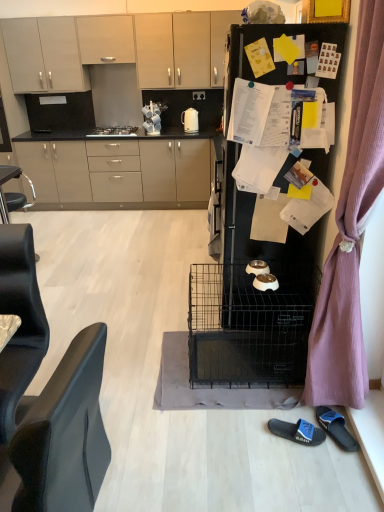
You are a GUI agent. You are given a task and a screenshot of the screen. Output one action in this format:
    pyautogui.click(x=<x>, y=<y>)
    Task: Click on the empty space that is ontop of white glossy electric kettle at upper center
    
    Given the screenshot: What is the action you would take?
    pyautogui.click(x=188, y=106)